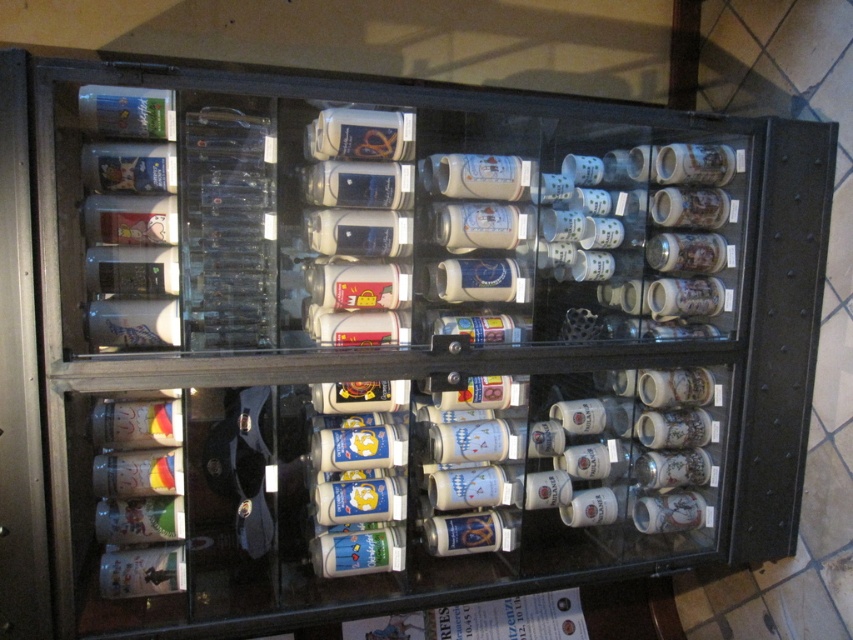
Question: Does matte glass mug at upper center appear on the right side of translucent glass bottle at upper left?

Choices:
 (A) no
 (B) yes

Answer: (B)

Question: Which object is the closest to the translucent glass bottle at upper left?

Choices:
 (A) white glossy mug at center
 (B) matte glass bottle at center
 (C) matte plastic bottle at upper left
 (D) matte glass mug at upper center

Answer: (C)

Question: Which point is farther from the camera taking this photo?

Choices:
 (A) (161, 125)
 (B) (405, 132)
 (C) (346, 564)

Answer: (C)

Question: Estimate the real-world distances between objects in this image. Which object is farther from the matte plastic bottle at upper left?

Choices:
 (A) white glossy mug at center
 (B) matte glass bottle at center
 (C) matte glass mug at upper center

Answer: (B)

Question: Does white glossy mug at center appear under translucent glass bottle at upper left?

Choices:
 (A) no
 (B) yes

Answer: (B)

Question: Can you confirm if matte plastic bottle at upper left is positioned to the left of matte glass bottle at center?

Choices:
 (A) no
 (B) yes

Answer: (B)